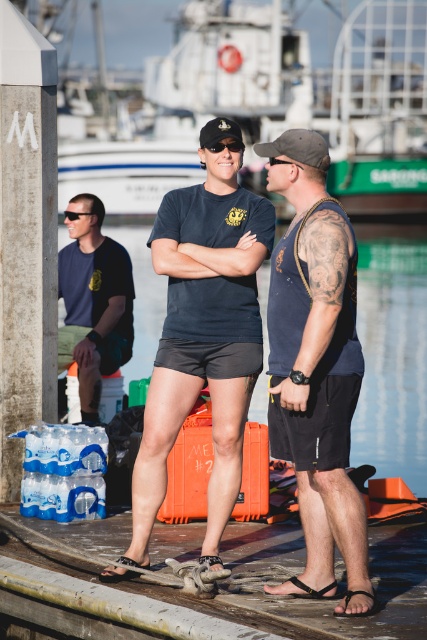
Question: Estimate the real-world distances between objects in this image. Which object is closer to the matte blue shirt at left?

Choices:
 (A) wooden at center
 (B) dark blue tank top at center

Answer: (B)

Question: Does matte navy t-shirt at center appear on the right side of wooden at center?

Choices:
 (A) yes
 (B) no

Answer: (A)

Question: Where is matte navy t-shirt at center located in relation to wooden at center in the image?

Choices:
 (A) left
 (B) right

Answer: (B)

Question: In this image, where is black matte baseball cap at center located relative to black reflective sunglasses at center?

Choices:
 (A) left
 (B) right

Answer: (A)

Question: Which of these objects is positioned farthest from the matte navy t-shirt at center?

Choices:
 (A) dark blue tank top at center
 (B) matte blue shirt at left

Answer: (B)

Question: Estimate the real-world distances between objects in this image. Which object is farther from the matte navy t-shirt at center?

Choices:
 (A) black matte baseball cap at center
 (B) black reflective sunglasses at center
 (C) matte blue shirt at left
 (D) wooden at center

Answer: (C)